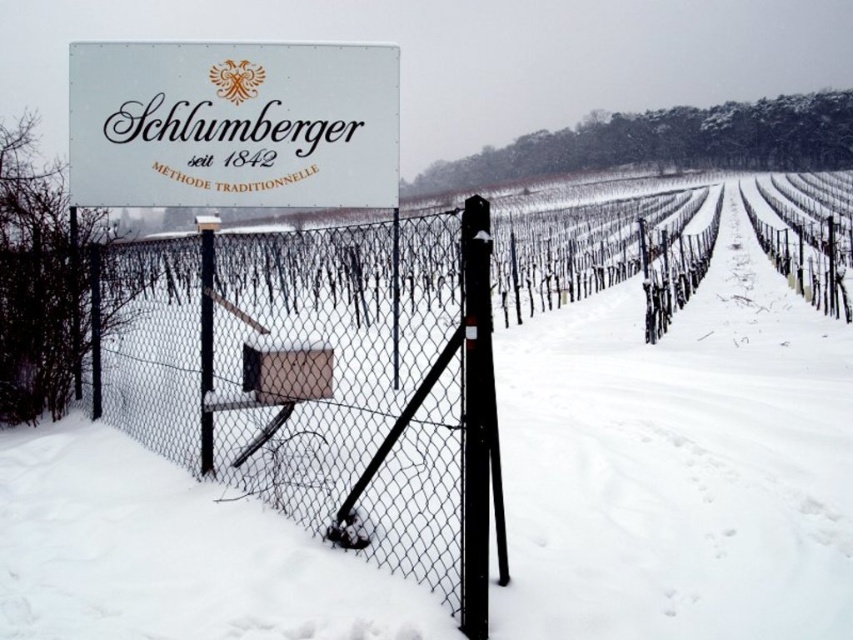
Measure the distance from white powdery snow at center to white matte sign at upper center.

white powdery snow at center and white matte sign at upper center are 3.57 meters apart.

Between white powdery snow at center and white matte sign at upper center, which one has less height?

With less height is white matte sign at upper center.

What do you see at coordinates (677, 461) in the screenshot? The width and height of the screenshot is (853, 640). I see `white powdery snow at center` at bounding box center [677, 461].

Find the location of a particular element. white powdery snow at center is located at coordinates (677, 461).